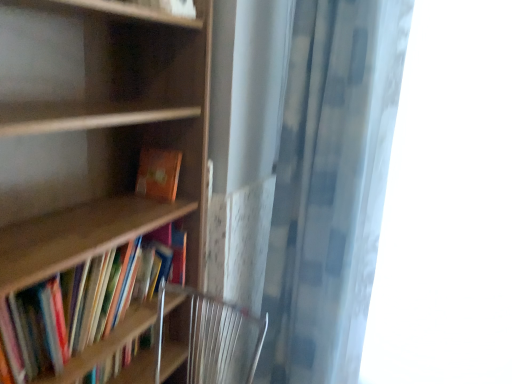
What do you see at coordinates (331, 187) in the screenshot? This screenshot has width=512, height=384. I see `checkered fabric shower curtain at right` at bounding box center [331, 187].

Image resolution: width=512 pixels, height=384 pixels. Describe the element at coordinates (92, 179) in the screenshot. I see `wooden bookcase at left` at that location.

Measure the distance between point (169,82) and camera.

The distance of point (169,82) from camera is 1.40 meters.

Describe the element at coordinates (448, 206) in the screenshot. I see `transparent fabric at right` at that location.

You are a GUI agent. You are given a task and a screenshot of the screen. Output one action in this format:
    pyautogui.click(x=<x>, y=<y>)
    Task: Click on the orange matte book at center, the first book positioned from the top
    The width and height of the screenshot is (512, 384).
    Given the screenshot: What is the action you would take?
    pyautogui.click(x=158, y=173)

Considering the relative sizes of orange matte book at center, which is the 2th book in bottom-to-top order, and wooden bookshelf at left, which appears as the 1th book when ordered from the bottom, in the image provided, is orange matte book at center, which is the 2th book in bottom-to-top order, taller than wooden bookshelf at left, which appears as the 1th book when ordered from the bottom,?

No.

Would you say wooden bookshelf at left, which appears as the 2th book when viewed from the top, is part of orange matte book at center, which is the 2th book in bottom-to-top order,'s contents?

No.

This screenshot has height=384, width=512. I want to click on book lying on the left of orange matte book at center, the first book positioned from the top, so click(x=79, y=308).

From a real-world perspective, is orange matte book at center, the first book positioned from the top, positioned above or below wooden bookshelf at left, which appears as the 2th book when viewed from the top?

From a real-world perspective, orange matte book at center, the first book positioned from the top, is physically above wooden bookshelf at left, which appears as the 2th book when viewed from the top.

Consider the image. Considering the relative positions of transparent fabric at right and wooden bookshelf at left, which appears as the 1th book when ordered from the bottom, in the image provided, is transparent fabric at right to the left of wooden bookshelf at left, which appears as the 1th book when ordered from the bottom, from the viewer's perspective?

No, transparent fabric at right is not to the left of wooden bookshelf at left, which appears as the 1th book when ordered from the bottom.

Does transparent fabric at right come behind wooden bookshelf at left, which appears as the 2th book when viewed from the top?

Yes, it is.

The width and height of the screenshot is (512, 384). In the image, there is a transparent fabric at right. What are the coordinates of `book below it (from the image's perspective)` in the screenshot? It's located at (79, 308).

Which of these two, transparent fabric at right or wooden bookshelf at left, which appears as the 2th book when viewed from the top, is thinner?

Thinner between the two is wooden bookshelf at left, which appears as the 2th book when viewed from the top.

From the picture: From a real-world perspective, is transparent fabric at right on top of wooden bookcase at left?

Yes, from a real-world perspective, transparent fabric at right is above wooden bookcase at left.

Who is more distant, transparent fabric at right or wooden bookcase at left?

transparent fabric at right is behind.

Based on the photo, how different are the orientations of transparent fabric at right and wooden bookcase at left in degrees?

The angular difference between transparent fabric at right and wooden bookcase at left is 87.9 degrees.

From the image's perspective, between transparent fabric at right and wooden bookcase at left, who is located below?

wooden bookcase at left.

Between checkered fabric shower curtain at right and wooden bookshelf at left, which appears as the 2th book when viewed from the top, which one has larger size?

checkered fabric shower curtain at right is bigger.

Where is `book below the checkered fabric shower curtain at right (from the image's perspective)`? book below the checkered fabric shower curtain at right (from the image's perspective) is located at coordinates (79, 308).

Considering their positions, is checkered fabric shower curtain at right located in front of or behind wooden bookshelf at left, which appears as the 1th book when ordered from the bottom?

Clearly, checkered fabric shower curtain at right is behind wooden bookshelf at left, which appears as the 1th book when ordered from the bottom.

From the image's perspective, which one is positioned higher, orange matte book at center, the first book positioned from the top, or transparent fabric at right?

From the image's view, orange matte book at center, the first book positioned from the top, is above.

Who is more distant, orange matte book at center, the first book positioned from the top, or transparent fabric at right?

orange matte book at center, the first book positioned from the top, is behind.

Is point (142, 183) positioned after point (511, 48)?

Yes, it is.

From their relative heights in the image, would you say orange matte book at center, the first book positioned from the top, is taller or shorter than checkered fabric shower curtain at right?

Considering their sizes, orange matte book at center, the first book positioned from the top, has less height than checkered fabric shower curtain at right.

Is orange matte book at center, which is the 2th book in bottom-to-top order, far from checkered fabric shower curtain at right?

Actually, orange matte book at center, which is the 2th book in bottom-to-top order, and checkered fabric shower curtain at right are a little close together.

Is point (181, 153) behind point (356, 324)?

No.

Considering the sizes of objects transparent fabric at right and checkered fabric shower curtain at right in the image provided, who is taller, transparent fabric at right or checkered fabric shower curtain at right?

transparent fabric at right.

From a real-world perspective, between transparent fabric at right and checkered fabric shower curtain at right, who is vertically lower?

From a 3D spatial view, transparent fabric at right is below.

Between transparent fabric at right and checkered fabric shower curtain at right, which one has smaller width?

transparent fabric at right is thinner.

Find the location of a particular element. book below the orange matte book at center, the first book positioned from the top (from the image's perspective) is located at coordinates (79, 308).

Locate an element on the screen. window that is above the wooden bookshelf at left, which appears as the 1th book when ordered from the bottom (from the image's perspective) is located at coordinates (448, 206).

Looking at the image, which one is located further to checkered fabric shower curtain at right, transparent fabric at right or wooden bookshelf at left, which appears as the 1th book when ordered from the bottom?

Among the two, wooden bookshelf at left, which appears as the 1th book when ordered from the bottom, is located further to checkered fabric shower curtain at right.

Looking at the image, which one is located closer to checkered fabric shower curtain at right, wooden bookcase at left or transparent fabric at right?

transparent fabric at right is closer to checkered fabric shower curtain at right.

Estimate the real-world distances between objects in this image. Which object is further from checkered fabric shower curtain at right, orange matte book at center, the first book positioned from the top, or transparent fabric at right?

Based on the image, orange matte book at center, the first book positioned from the top, appears to be further to checkered fabric shower curtain at right.

Estimate the real-world distances between objects in this image. Which object is further from wooden bookcase at left, checkered fabric shower curtain at right or orange matte book at center, the first book positioned from the top?

Based on the image, checkered fabric shower curtain at right appears to be further to wooden bookcase at left.

Estimate the real-world distances between objects in this image. Which object is further from checkered fabric shower curtain at right, transparent fabric at right or wooden bookcase at left?

Among the two, wooden bookcase at left is located further to checkered fabric shower curtain at right.

From the image, which object appears to be farther from wooden bookcase at left, orange matte book at center, which is the 2th book in bottom-to-top order, or transparent fabric at right?

Among the two, transparent fabric at right is located further to wooden bookcase at left.

Which object lies nearer to the anchor point wooden bookshelf at left, which appears as the 2th book when viewed from the top, transparent fabric at right or checkered fabric shower curtain at right?

Among the two, checkered fabric shower curtain at right is located nearer to wooden bookshelf at left, which appears as the 2th book when viewed from the top.

Looking at this image, based on their spatial positions, is transparent fabric at right or checkered fabric shower curtain at right further from wooden bookcase at left?

transparent fabric at right lies further to wooden bookcase at left than the other object.

Locate an element on the screen. book between wooden bookcase at left and orange matte book at center, the first book positioned from the top, along the z-axis is located at coordinates (79, 308).

Find the location of a particular element. This screenshot has width=512, height=384. shower curtain located between wooden bookcase at left and transparent fabric at right in the left-right direction is located at coordinates tap(331, 187).

Find the location of a particular element. The height and width of the screenshot is (384, 512). book situated between wooden bookshelf at left, which appears as the 1th book when ordered from the bottom, and transparent fabric at right from left to right is located at coordinates (158, 173).

The height and width of the screenshot is (384, 512). In order to click on shower curtain between wooden bookcase at left and orange matte book at center, which is the 2th book in bottom-to-top order, along the z-axis in this screenshot , I will do `click(331, 187)`.